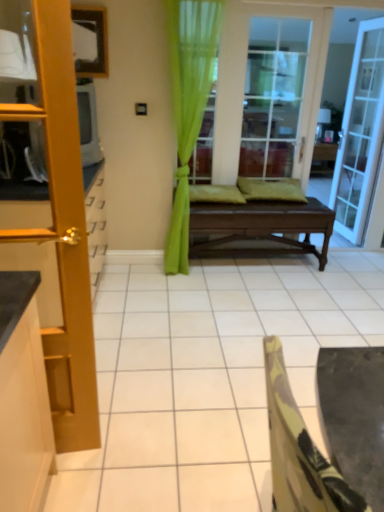
Question: Is dark brown wooden bench at center oriented towards green sheer curtain at center?

Choices:
 (A) yes
 (B) no

Answer: (B)

Question: Considering the relative sizes of dark brown wooden bench at center and green sheer curtain at center in the image provided, is dark brown wooden bench at center thinner than green sheer curtain at center?

Choices:
 (A) yes
 (B) no

Answer: (B)

Question: Considering the relative positions of dark brown wooden bench at center and green sheer curtain at center in the image provided, is dark brown wooden bench at center in front of green sheer curtain at center?

Choices:
 (A) no
 (B) yes

Answer: (A)

Question: Can you confirm if dark brown wooden bench at center is shorter than green sheer curtain at center?

Choices:
 (A) yes
 (B) no

Answer: (A)

Question: Does dark brown wooden bench at center appear on the left side of green sheer curtain at center?

Choices:
 (A) yes
 (B) no

Answer: (B)

Question: Is dark brown wooden bench at center turned away from green sheer curtain at center?

Choices:
 (A) no
 (B) yes

Answer: (A)

Question: From a real-world perspective, is wooden door at left, the 1th door in the front-to-back sequence, physically below dark brown wooden bench at center?

Choices:
 (A) yes
 (B) no

Answer: (B)

Question: From a real-world perspective, is wooden door at left, arranged as the second door when viewed from the back, on dark brown wooden bench at center?

Choices:
 (A) no
 (B) yes

Answer: (B)

Question: Is dark brown wooden bench at center a part of wooden door at left, the 1th door in the left-to-right sequence?

Choices:
 (A) yes
 (B) no

Answer: (B)

Question: Is wooden door at left, the 1th door in the front-to-back sequence, wider than dark brown wooden bench at center?

Choices:
 (A) no
 (B) yes

Answer: (A)

Question: Does wooden door at left, the 1th door in the front-to-back sequence, appear on the left side of dark brown wooden bench at center?

Choices:
 (A) no
 (B) yes

Answer: (B)

Question: Are wooden door at left, the 1th door in the left-to-right sequence, and dark brown wooden bench at center located far from each other?

Choices:
 (A) yes
 (B) no

Answer: (A)

Question: Is the depth of dark brown wooden bench at center greater than that of camouflage fabric chair at lower right?

Choices:
 (A) no
 (B) yes

Answer: (B)